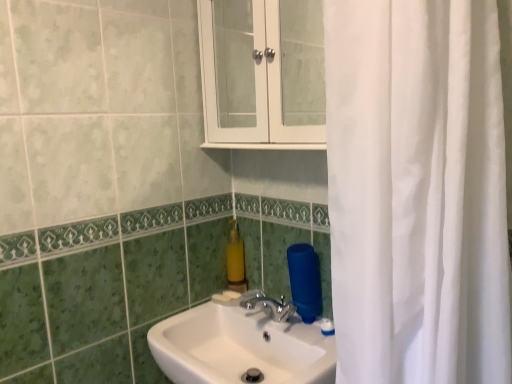
Question: In terms of size, does white glossy cabinet at upper center appear bigger or smaller than yellow matte soap dispenser at center?

Choices:
 (A) big
 (B) small

Answer: (A)

Question: Considering the positions of white glossy cabinet at upper center and yellow matte soap dispenser at center in the image, is white glossy cabinet at upper center taller or shorter than yellow matte soap dispenser at center?

Choices:
 (A) tall
 (B) short

Answer: (A)

Question: Which object is the farthest from the white glossy cabinet at upper center?

Choices:
 (A) white glossy sink at center
 (B) yellow matte soap dispenser at center

Answer: (A)

Question: Which of these objects is positioned farthest from the yellow matte soap dispenser at center?

Choices:
 (A) white glossy cabinet at upper center
 (B) white glossy sink at center

Answer: (A)